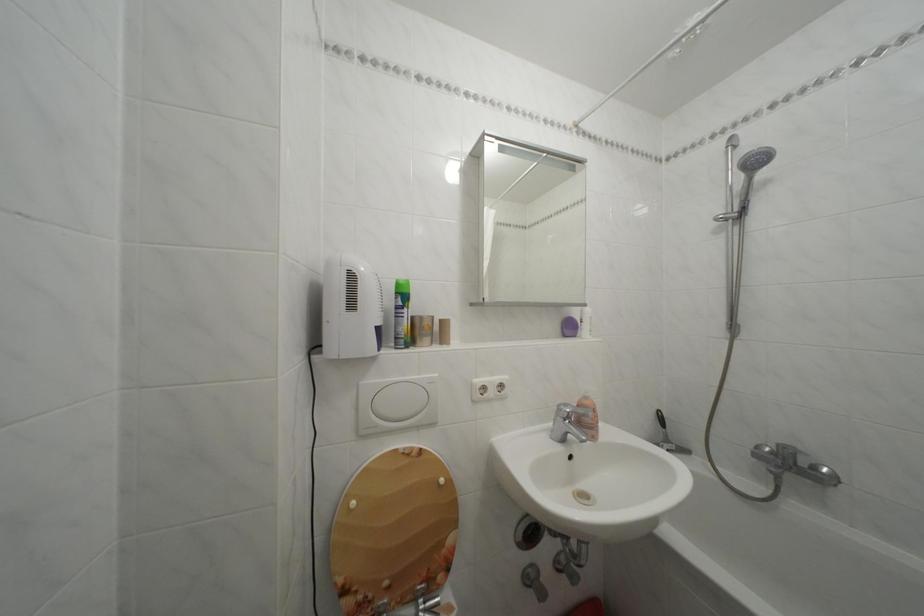
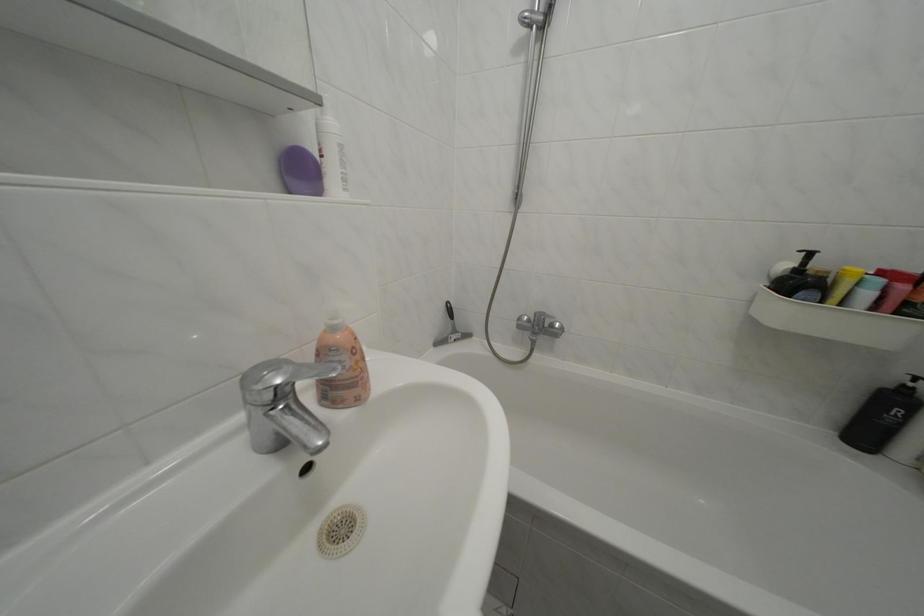
Locate, in the second image, the point that corresponds to (594,403) in the first image.

(342, 334)